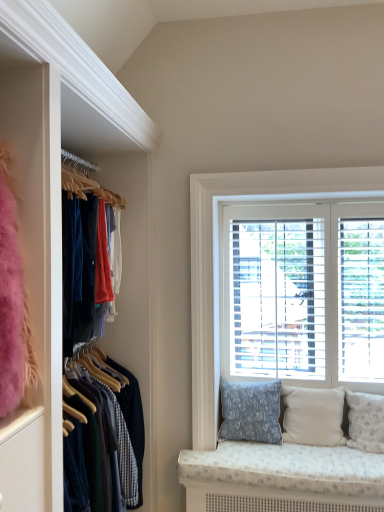
At what (x,y) coordinates should I click in order to perform the action: click on blank space situated above white wood blinds at upper right (from a real-world perspective). Please return your answer as a coordinate pair (x, y). The width and height of the screenshot is (384, 512). Looking at the image, I should click on (293, 198).